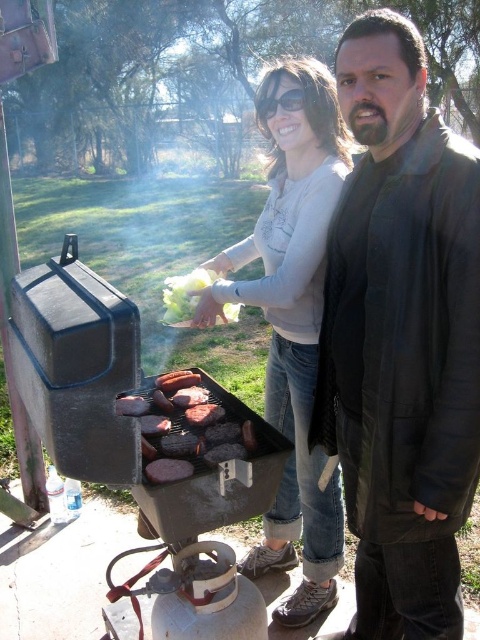
Does translucent yellow plastic bag at center come behind black plastic sunglasses at upper center?

Yes, it is.

Can you confirm if translucent yellow plastic bag at center is thinner than black plastic sunglasses at upper center?

In fact, translucent yellow plastic bag at center might be wider than black plastic sunglasses at upper center.

Who is more forward, [181,285] or [297,92]?

Point [297,92]

Where is `translucent yellow plastic bag at center`? translucent yellow plastic bag at center is located at coordinates (184, 296).

Is matte white sweater at center shorter than translucent yellow plastic bag at center?

Incorrect, matte white sweater at center's height does not fall short of translucent yellow plastic bag at center's.

The height and width of the screenshot is (640, 480). I want to click on matte white sweater at center, so click(x=292, y=324).

I want to click on matte white sweater at center, so [x=292, y=324].

Is matte white sweater at center closer to the viewer compared to brown charred meat at center?

That is False.

Is matte white sweater at center bigger than brown charred meat at center?

Yes.

Where is `matte white sweater at center`? This screenshot has width=480, height=640. matte white sweater at center is located at coordinates (292, 324).